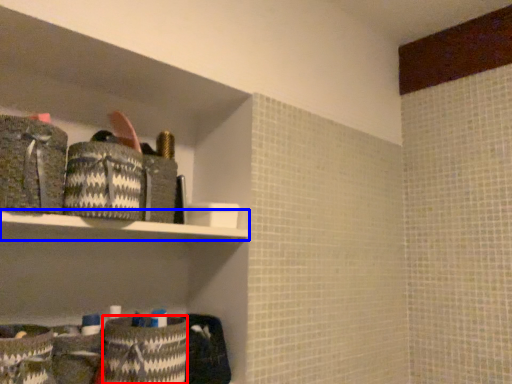
Question: Which of the following is the closest to the observer, material (highlighted by a red box) or shelf (highlighted by a blue box)?

Choices:
 (A) material
 (B) shelf

Answer: (B)